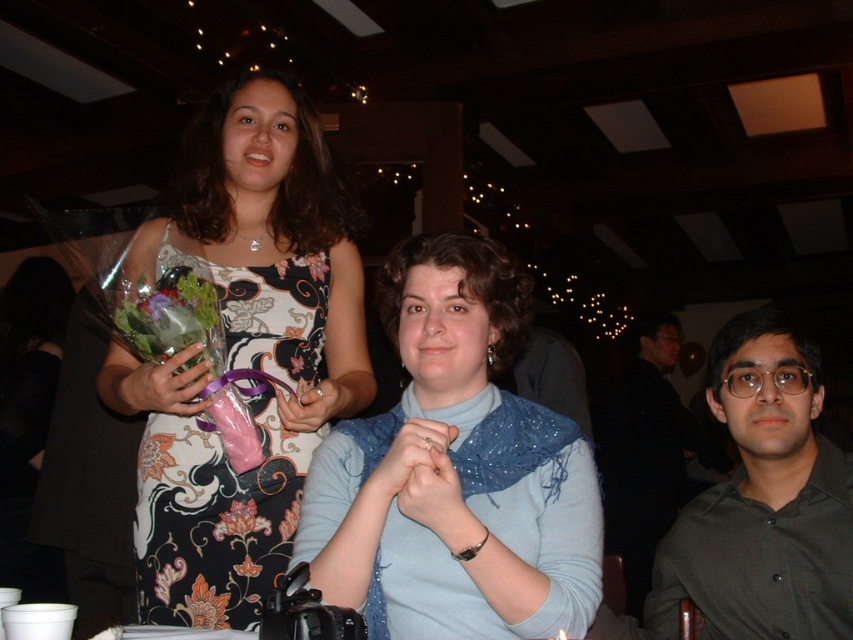
Measure the distance from floral-patterned bouquet at upper left to orange matte flower at center.

10.34 inches

Who is more forward, (148,464) or (252,572)?

Point (252,572)

Measure the distance between point (x=155, y=444) and camera.

Point (x=155, y=444) and camera are 4.47 feet apart.

You are a GUI agent. You are given a task and a screenshot of the screen. Output one action in this format:
    pyautogui.click(x=<x>, y=<y>)
    Task: Click on the floral-patterned bouquet at upper left
    The image size is (853, 640).
    Given the screenshot: What is the action you would take?
    pyautogui.click(x=154, y=456)

Is green shirt at right smaller than pink satin ribbon at center?

Incorrect, green shirt at right is not smaller in size than pink satin ribbon at center.

Does point (833, 472) come in front of point (283, 536)?

Yes, point (833, 472) is in front of point (283, 536).

Is point (843, 634) farther from viewer compared to point (294, 500)?

No, (843, 634) is closer to viewer.

The width and height of the screenshot is (853, 640). I want to click on green shirt at right, so click(763, 500).

Between blue fabric scarf at center and green shirt at right, which one has more height?

Standing taller between the two is green shirt at right.

Can you confirm if blue fabric scarf at center is positioned to the left of green shirt at right?

Correct, you'll find blue fabric scarf at center to the left of green shirt at right.

Does point (473, 349) come closer to viewer compared to point (756, 540)?

Yes, point (473, 349) is closer to viewer.

Identify the location of blue fabric scarf at center. Image resolution: width=853 pixels, height=640 pixels. (456, 472).